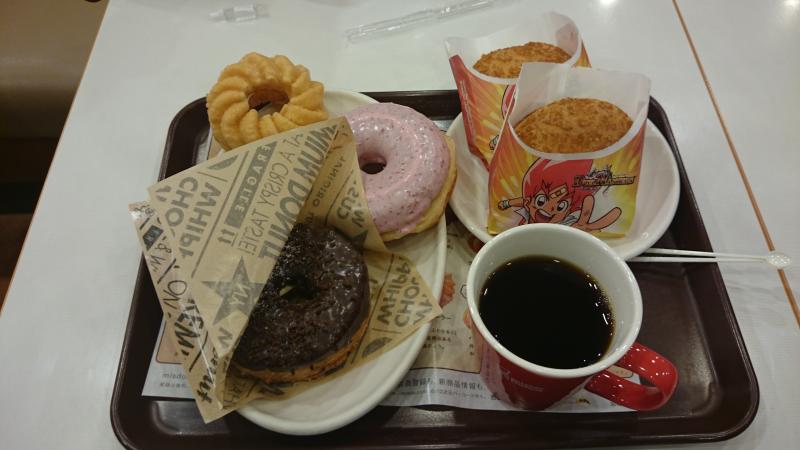
Locate an element on the screen. Image resolution: width=800 pixels, height=450 pixels. plate is located at coordinates (352, 391).